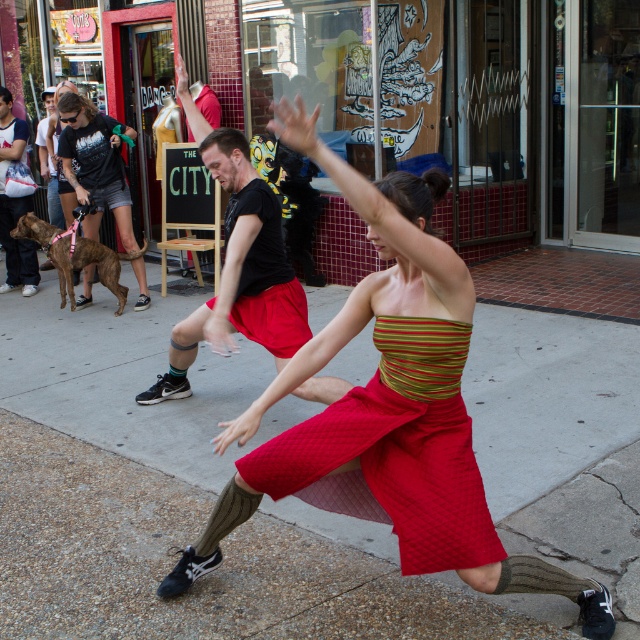
Question: Is quilted red dress at center below black cotton t-shirt at center?

Choices:
 (A) no
 (B) yes

Answer: (B)

Question: Which point appears farthest from the camera in this image?

Choices:
 (A) click(x=310, y=429)
 (B) click(x=81, y=452)

Answer: (B)

Question: Which object is positioned farthest from the matte black t-shirt at left?

Choices:
 (A) smooth concrete pavement at center
 (B) quilted red dress at center

Answer: (A)

Question: Does smooth concrete pavement at center have a larger size compared to black cotton t-shirt at center?

Choices:
 (A) yes
 (B) no

Answer: (B)

Question: Considering the real-world distances, which object is farthest from the black cotton t-shirt at center?

Choices:
 (A) matte black t-shirt at left
 (B) quilted red dress at center

Answer: (A)

Question: Is smooth concrete pavement at center smaller than matte black t-shirt at left?

Choices:
 (A) no
 (B) yes

Answer: (B)